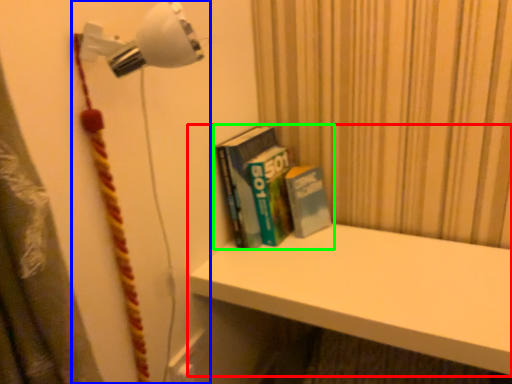
Question: Considering the real-world distances, which object is farthest from shelf (highlighted by a red box)? lamp (highlighted by a blue box) or book (highlighted by a green box)?

Choices:
 (A) lamp
 (B) book

Answer: (A)